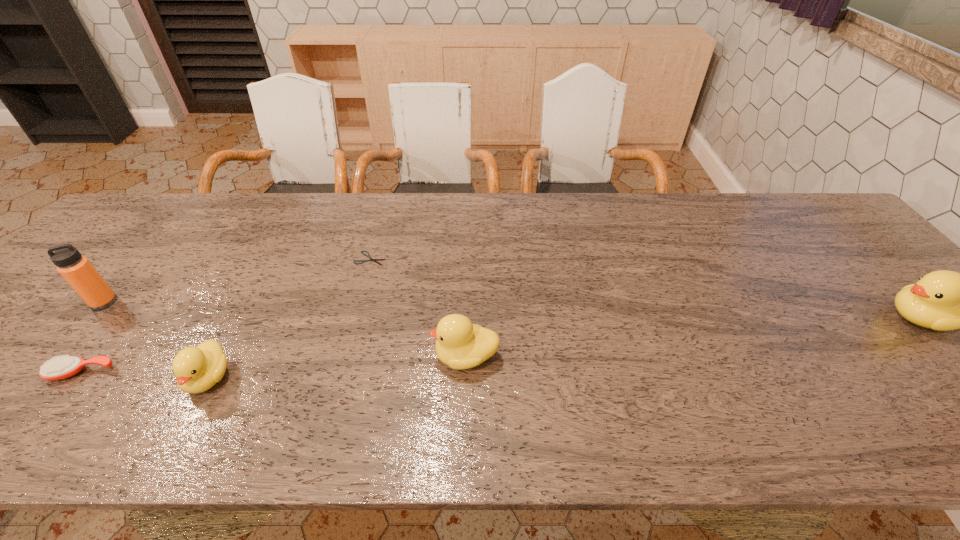
The width and height of the screenshot is (960, 540). I want to click on vacant space at the left edge of the desktop, so click(x=62, y=349).

Image resolution: width=960 pixels, height=540 pixels. In the image, there is a desktop. What are the coordinates of `vacant space at the right edge` in the screenshot? It's located at (891, 291).

Find the location of `vacant area at the far left corner of the desktop`. vacant area at the far left corner of the desktop is located at coordinates (156, 214).

Find the location of a particular element. The width and height of the screenshot is (960, 540). vacant space at the far right corner of the desktop is located at coordinates (776, 209).

Locate an element on the screen. This screenshot has height=540, width=960. free spot between the leftmost duckling and the farthest object is located at coordinates (290, 318).

Where is `free space between the farthest object and the second object from right to left`? free space between the farthest object and the second object from right to left is located at coordinates click(x=419, y=307).

I want to click on unoccupied position between the fifth tallest object and the fourth object from left to right, so click(226, 316).

Find the location of a particular element. free area in between the farthest object and the fourth shortest object is located at coordinates (419, 307).

You are a GUI agent. You are given a task and a screenshot of the screen. Output one action in this format:
    pyautogui.click(x=<x>, y=<y>)
    Task: Click on the vacant region between the third shortest object and the second shortest object
    The width and height of the screenshot is (960, 540).
    Given the screenshot: What is the action you would take?
    pyautogui.click(x=145, y=375)

You are a GUI agent. You are given a task and a screenshot of the screen. Output one action in this format:
    pyautogui.click(x=<x>, y=<y>)
    Task: Click on the empty space between the fifth tallest object and the shortest duckling
    This screenshot has height=540, width=960.
    Given the screenshot: What is the action you would take?
    pyautogui.click(x=145, y=375)